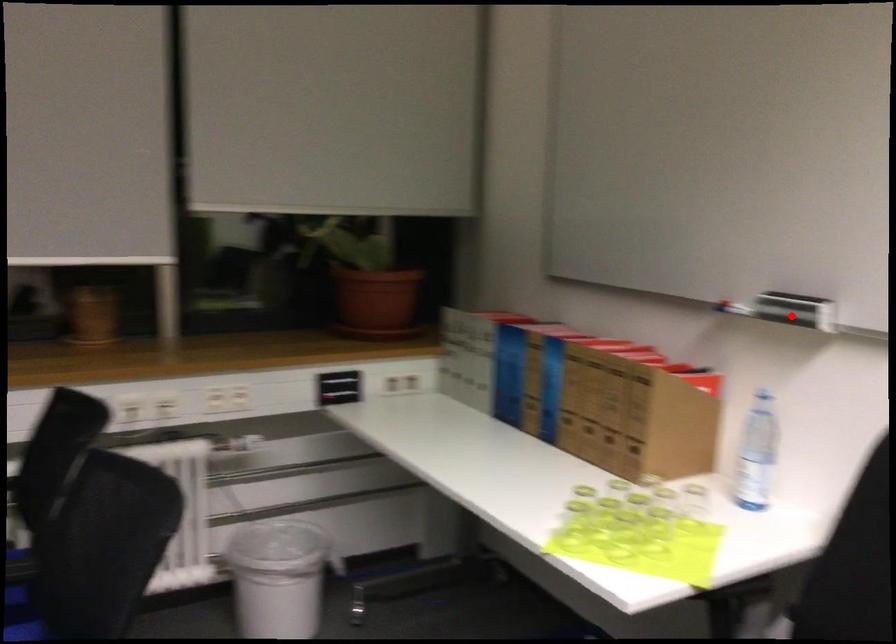
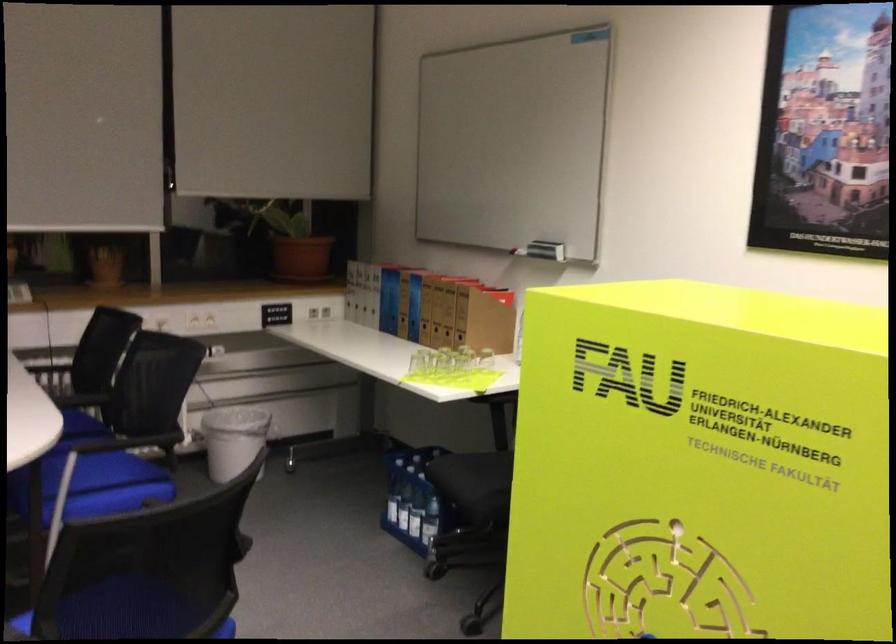
Where in the second image is the point corresponding to the highlighted location from the first image?

(546, 250)